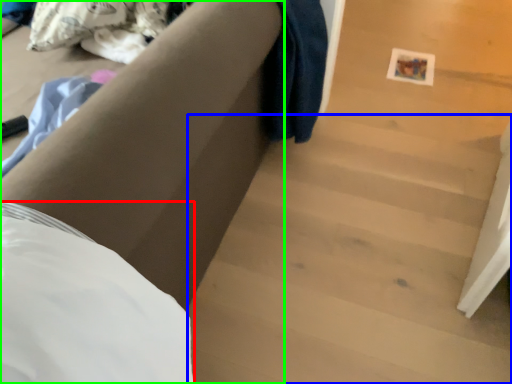
Question: Considering the real-world distances, which object is farthest from sheet (highlighted by a red box)? stairwell (highlighted by a blue box) or furniture (highlighted by a green box)?

Choices:
 (A) stairwell
 (B) furniture

Answer: (A)